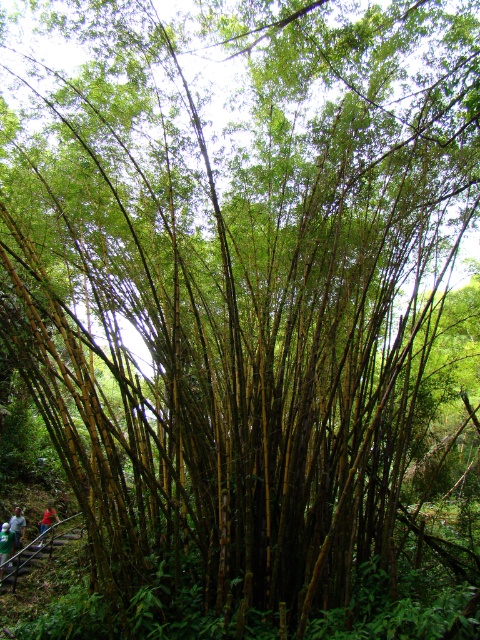
You are navigating through a bamboo grove and want to reach a specific spot marked by the point at coordinates point [11,554]. There is another point marked at point [47,518] in your path. Which point should you aim for first to stay on the correct path?

You should aim for point [11,554] first because it is in front of point [47,518], so reaching it first keeps you on the correct path.

You are navigating through a bamboo grove and need to determine the shortest path between two points marked in the scene. The points are labeled as point (10, 529) and point (20, 538). Based on their positions, which point is closer to you and would allow for a quicker approach?

Point (10, 529) is closer to the viewer than point (20, 538), so it would allow for a quicker approach.